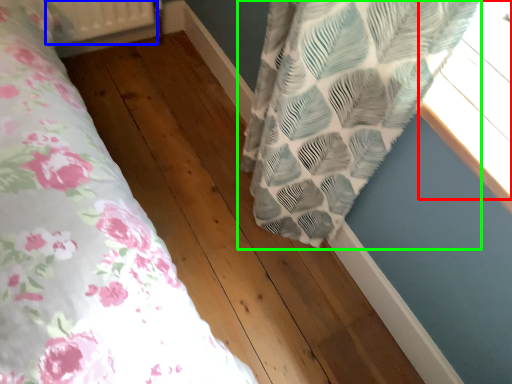
Question: Considering the real-world distances, which object is closest to window (highlighted by a red box)? radiator (highlighted by a blue box) or curtain (highlighted by a green box).

Choices:
 (A) radiator
 (B) curtain

Answer: (B)